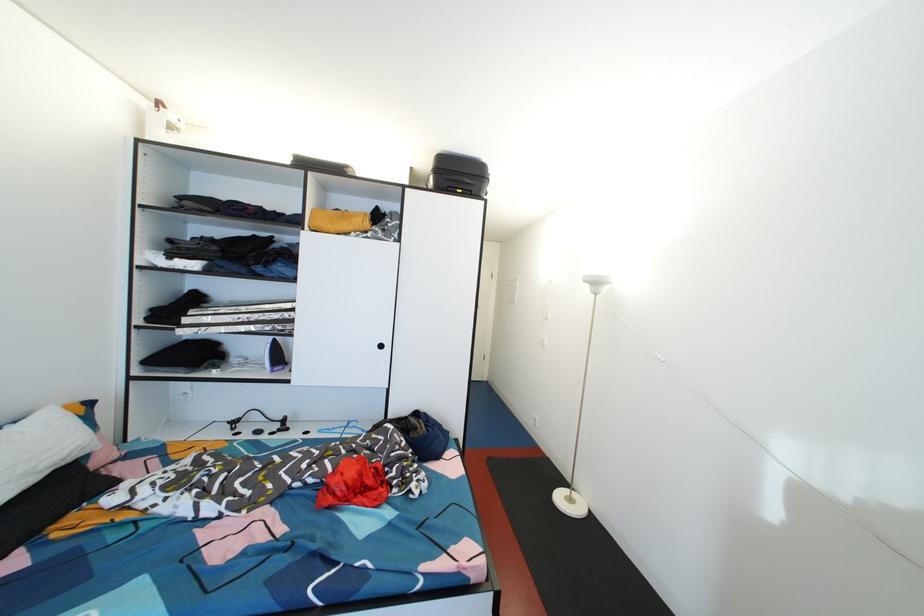
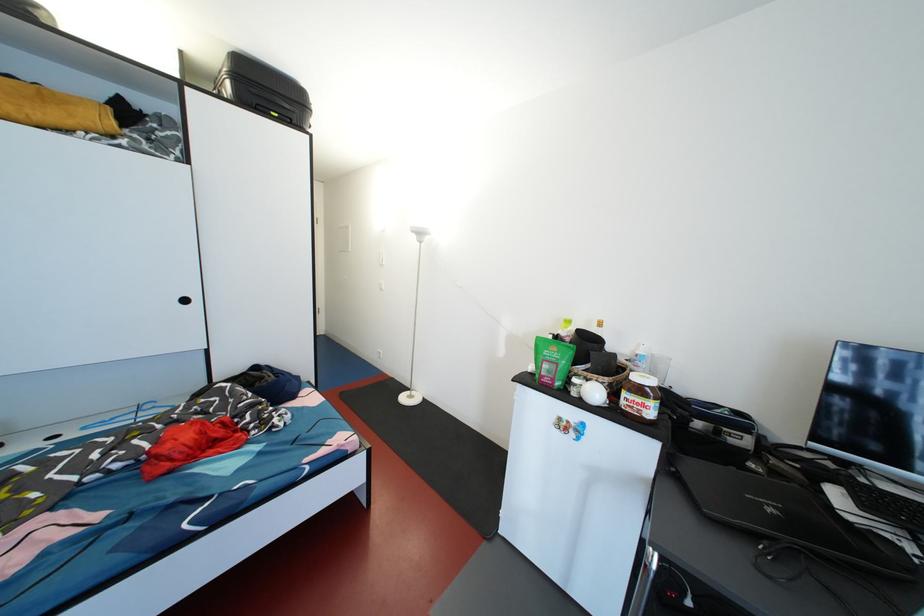
The point at (467, 196) is marked in the first image. Where is the corresponding point in the second image?

(283, 120)